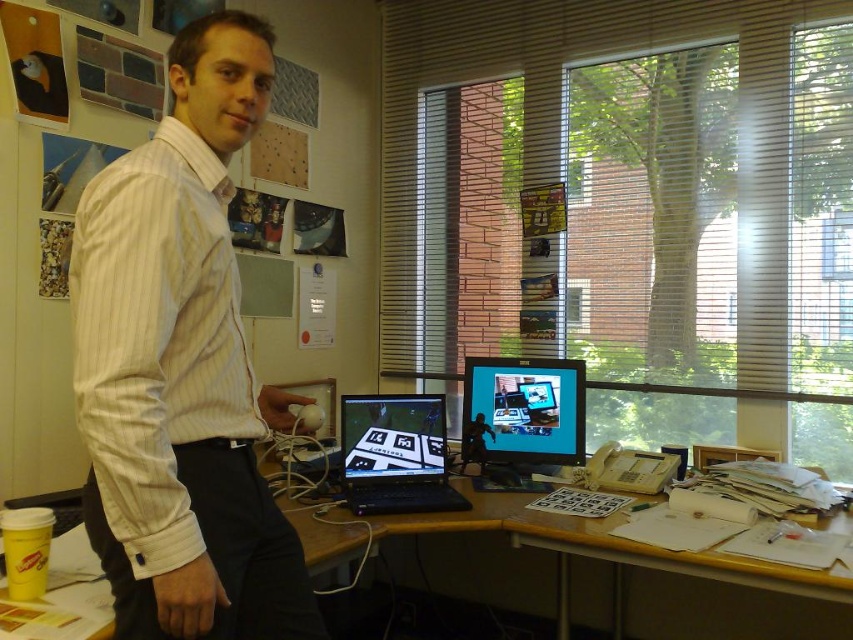
Question: Which point is farther to the camera?

Choices:
 (A) white striped shirt at center
 (B) black glossy laptop at center
 (C) white paper at lower right
 (D) matte black computer monitor at center

Answer: (D)

Question: Does white striped shirt at center appear on the left side of matte black computer monitor at center?

Choices:
 (A) yes
 (B) no

Answer: (A)

Question: Can you confirm if wooden desk at center is positioned to the right of matte black computer monitor at center?

Choices:
 (A) no
 (B) yes

Answer: (A)

Question: Can you confirm if matte black computer monitor at center is smaller than black glossy laptop at center?

Choices:
 (A) yes
 (B) no

Answer: (A)

Question: Which point is closer to the camera taking this photo?

Choices:
 (A) (828, 600)
 (B) (183, 227)
 (C) (556, 572)
 (D) (399, 401)

Answer: (B)

Question: Which of the following is the farthest from the observer?

Choices:
 (A) (386, 449)
 (B) (514, 403)

Answer: (B)